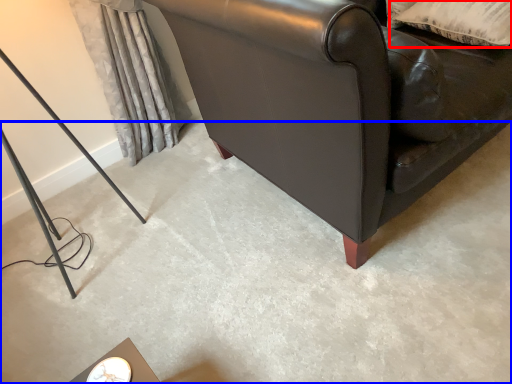
Question: Which point is closer to the camera, pillow (highlighted by a red box) or concrete (highlighted by a blue box)?

Choices:
 (A) pillow
 (B) concrete

Answer: (B)